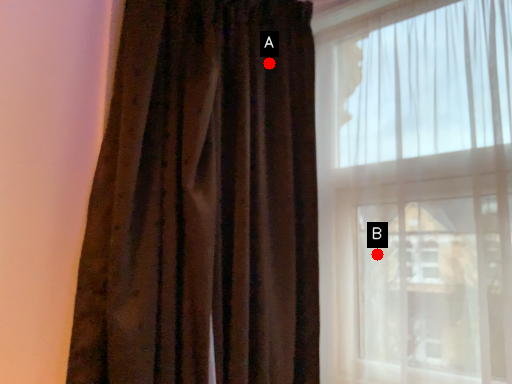
Question: Two points are circled on the image, labeled by A and B beside each circle. Which point is closer to the camera?

Choices:
 (A) A is closer
 (B) B is closer

Answer: (B)